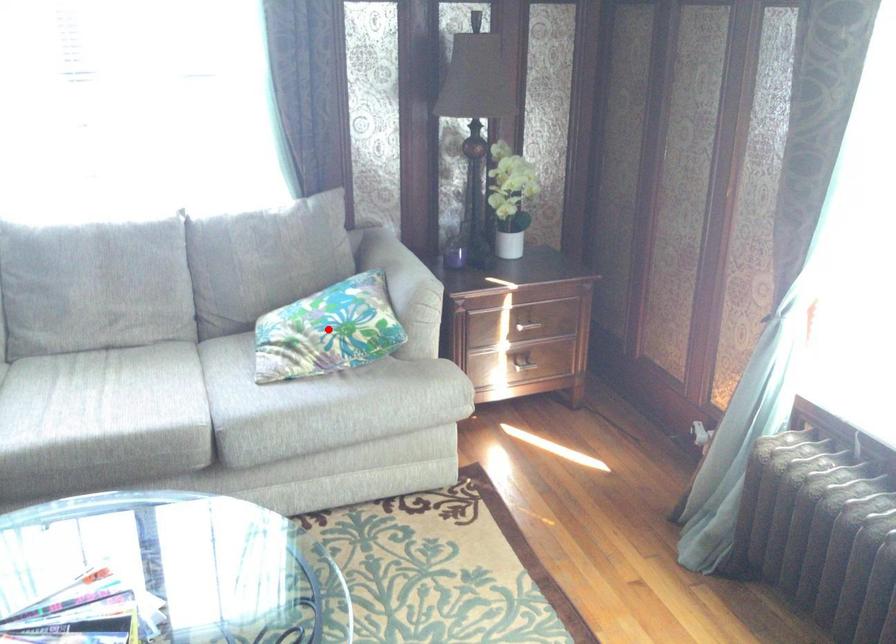
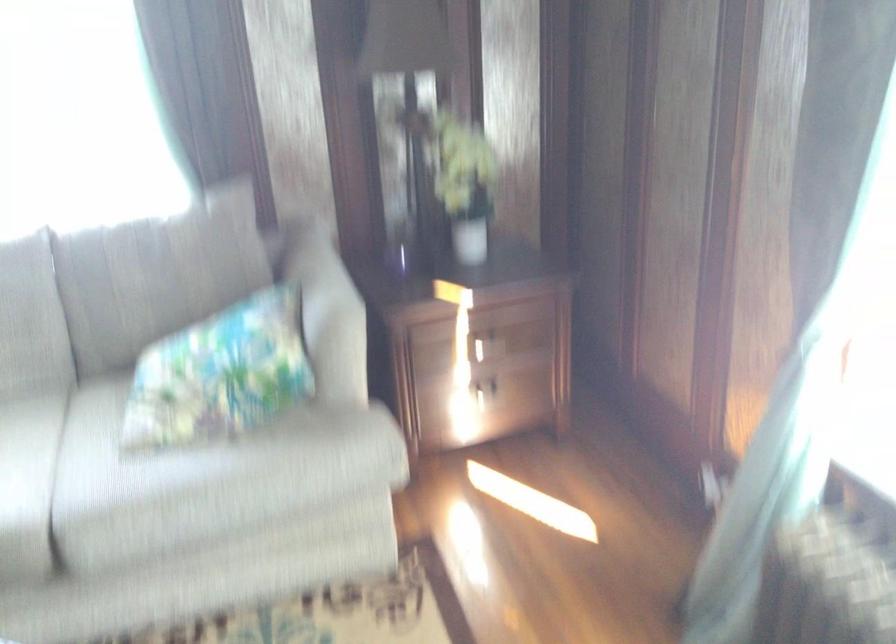
In the second image, find the point that corresponds to the highlighted location in the first image.

(220, 374)